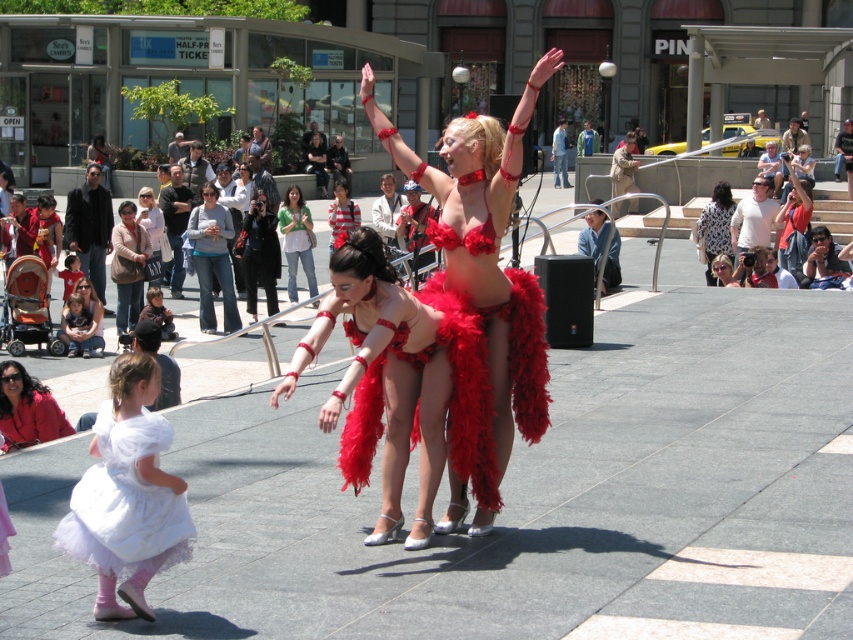
You are a photographer trying to capture both the white tulle dress at lower left and the red satin bikini top at center in a single frame. Which object should you focus on first to ensure both are in the frame?

The white tulle dress at lower left is much taller than the red satin bikini top at center, so you should focus on the white tulle dress at lower left first to ensure both are in the frame.

You are a photographer trying to capture the street performance. You notice the white tulle dress at lower left and the red satin bikini top at center. Which of these two items would appear bigger in your photo?

The white tulle dress at lower left appears bigger in the photo because it has a larger size compared to the red satin bikini top at center.

You are a photographer trying to capture the street performance. You notice the matte red dress at lower left and the green fabric shirt at center. Which object is positioned closer to you?

The matte red dress at lower left is closer to the viewer than the green fabric shirt at center.